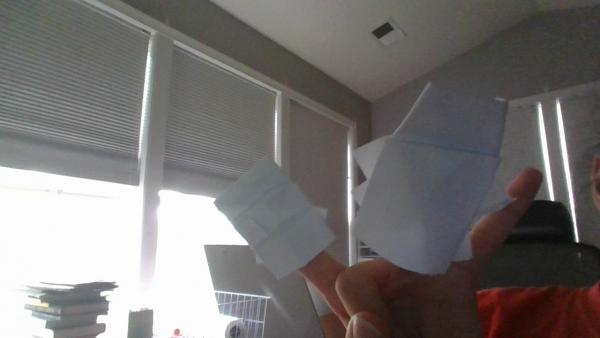
Locate an element on the screen. This screenshot has height=338, width=600. space between windows and blinds is located at coordinates (542, 135), (557, 133).